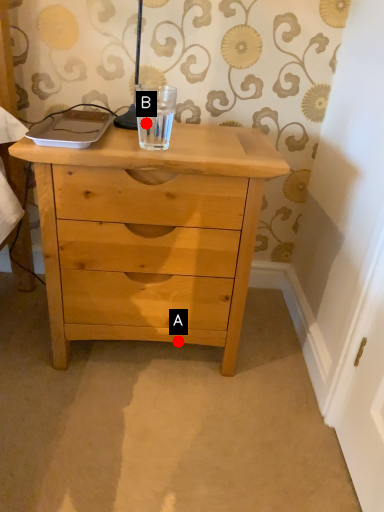
Question: Two points are circled on the image, labeled by A and B beside each circle. Which point is further to the camera?

Choices:
 (A) A is further
 (B) B is further

Answer: (A)